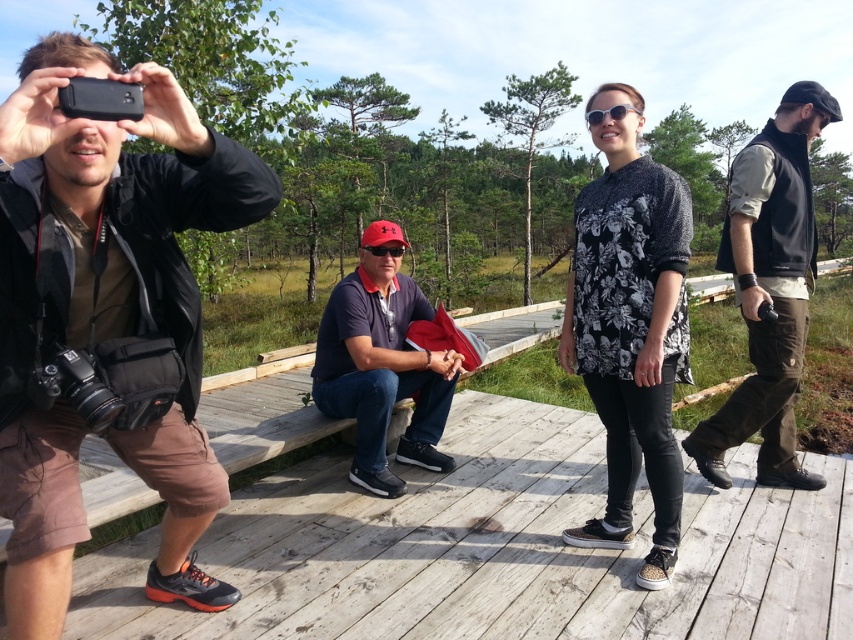
Question: Among these objects, which one is farthest from the camera?

Choices:
 (A) dark blue cotton shirt at center
 (B) black fleece vest at center
 (C) white plastic goggles at center

Answer: (A)

Question: Which of the following is the farthest from the observer?

Choices:
 (A) black floral shirt at center
 (B) dark blue cotton shirt at center

Answer: (B)

Question: Is black fleece vest at center further to camera compared to dark blue cotton shirt at center?

Choices:
 (A) no
 (B) yes

Answer: (A)

Question: Is wooden at center to the right of black fleece vest at center from the viewer's perspective?

Choices:
 (A) yes
 (B) no

Answer: (B)

Question: Can you confirm if wooden at center is positioned below black fleece vest at center?

Choices:
 (A) yes
 (B) no

Answer: (A)

Question: Which point is closer to the camera taking this photo?

Choices:
 (A) (587, 125)
 (B) (642, 180)
 (C) (187, 506)
 (D) (402, 252)

Answer: (C)